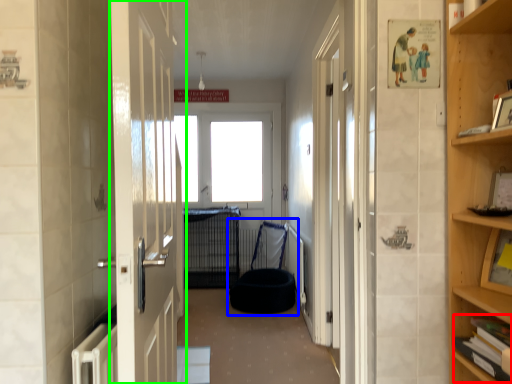
Question: Which object is positioned farthest from book (highlighted by a red box)? Select from bean bag chair (highlighted by a blue box) and door (highlighted by a green box).

Choices:
 (A) bean bag chair
 (B) door

Answer: (A)